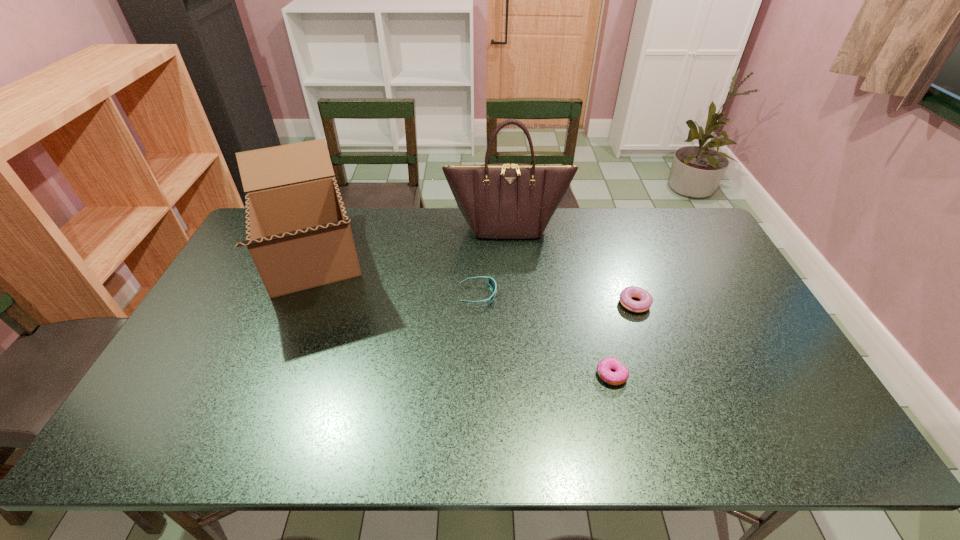
Identify the location of handbag. The width and height of the screenshot is (960, 540). (505, 200).

Find the location of `the second tallest object`. the second tallest object is located at coordinates (298, 233).

Locate an element on the screen. box is located at coordinates (298, 233).

The width and height of the screenshot is (960, 540). Find the location of `sunglasses`. sunglasses is located at coordinates click(x=491, y=281).

Locate an element on the screen. Image resolution: width=960 pixels, height=540 pixels. the rightmost object is located at coordinates (646, 300).

Identify the location of the farther doughnut. The image size is (960, 540). (646, 300).

Where is `the nearer doughnut`? Image resolution: width=960 pixels, height=540 pixels. the nearer doughnut is located at coordinates (604, 367).

Identify the location of the left doughnut. (604, 367).

Find the location of a particular element. free space located 0.370m on the front-facing side of the tallest object is located at coordinates (515, 321).

Identify the location of free space located 0.200m on the front of the fourth shortest object. The height and width of the screenshot is (540, 960). (258, 386).